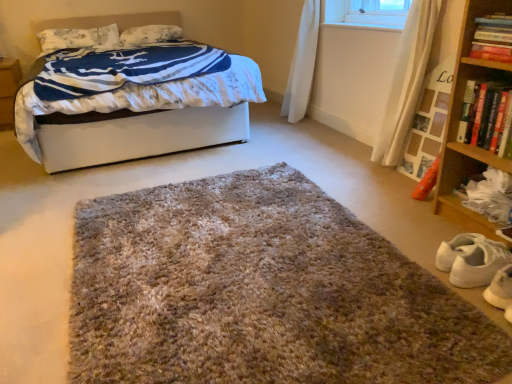
Question: From a real-world perspective, is wooden bookshelf at right located beneath white soft bed at upper left?

Choices:
 (A) no
 (B) yes

Answer: (A)

Question: Is wooden bookshelf at right in contact with white soft bed at upper left?

Choices:
 (A) no
 (B) yes

Answer: (A)

Question: Considering the relative positions of wooden bookshelf at right and white soft bed at upper left in the image provided, is wooden bookshelf at right to the right of white soft bed at upper left from the viewer's perspective?

Choices:
 (A) yes
 (B) no

Answer: (A)

Question: From a real-world perspective, does wooden bookshelf at right stand above white soft bed at upper left?

Choices:
 (A) no
 (B) yes

Answer: (B)

Question: Does wooden bookshelf at right lie in front of white soft bed at upper left?

Choices:
 (A) no
 (B) yes

Answer: (B)

Question: Does wooden bookshelf at right turn towards white soft bed at upper left?

Choices:
 (A) yes
 (B) no

Answer: (B)

Question: Is white soft bed at upper left oriented towards hardcover book at upper right, the 1th book viewed from the top?

Choices:
 (A) no
 (B) yes

Answer: (B)

Question: Is white soft bed at upper left bigger than hardcover book at upper right, the 1th book viewed from the top?

Choices:
 (A) no
 (B) yes

Answer: (B)

Question: Does white soft bed at upper left have a greater height compared to hardcover book at upper right, the second book ordered from the bottom?

Choices:
 (A) no
 (B) yes

Answer: (B)

Question: Considering the relative sizes of white soft bed at upper left and hardcover book at upper right, the second book ordered from the bottom, in the image provided, is white soft bed at upper left shorter than hardcover book at upper right, the second book ordered from the bottom,?

Choices:
 (A) yes
 (B) no

Answer: (B)

Question: Does white soft bed at upper left touch hardcover book at upper right, the second book ordered from the bottom?

Choices:
 (A) yes
 (B) no

Answer: (B)

Question: Could hardcover book at upper right, the 1th book viewed from the top, be considered to be inside white soft bed at upper left?

Choices:
 (A) no
 (B) yes

Answer: (A)

Question: Can you confirm if white floral fabric pillow at upper left, the 2th pillow viewed from the right, is wider than hardcover book at upper right, the 1th book viewed from the top?

Choices:
 (A) no
 (B) yes

Answer: (B)